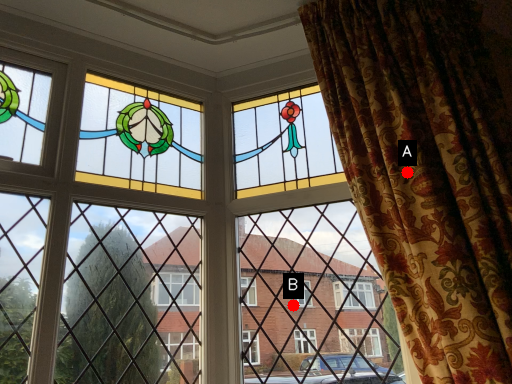
Question: Two points are circled on the image, labeled by A and B beside each circle. Which of the following is the farthest from the observer?

Choices:
 (A) A is further
 (B) B is further

Answer: (B)